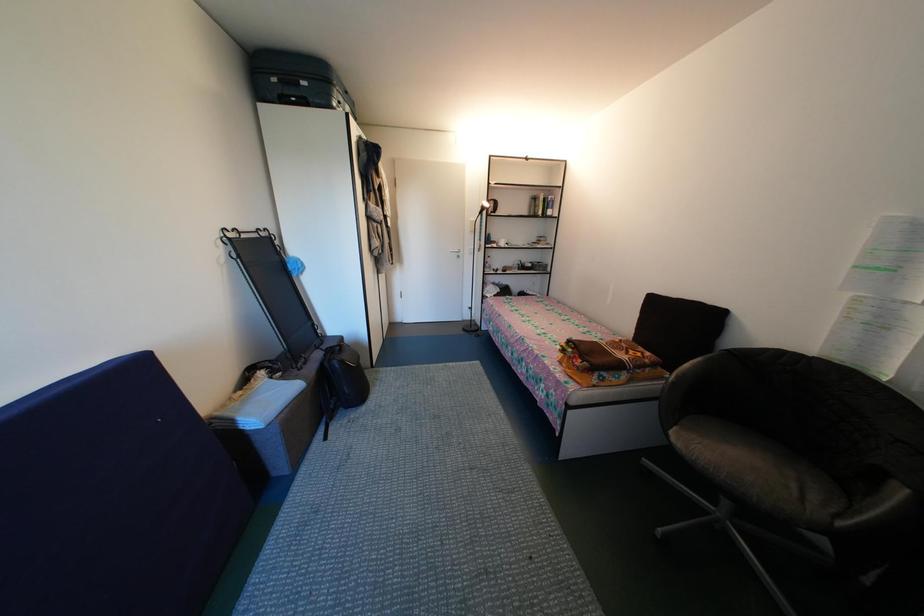
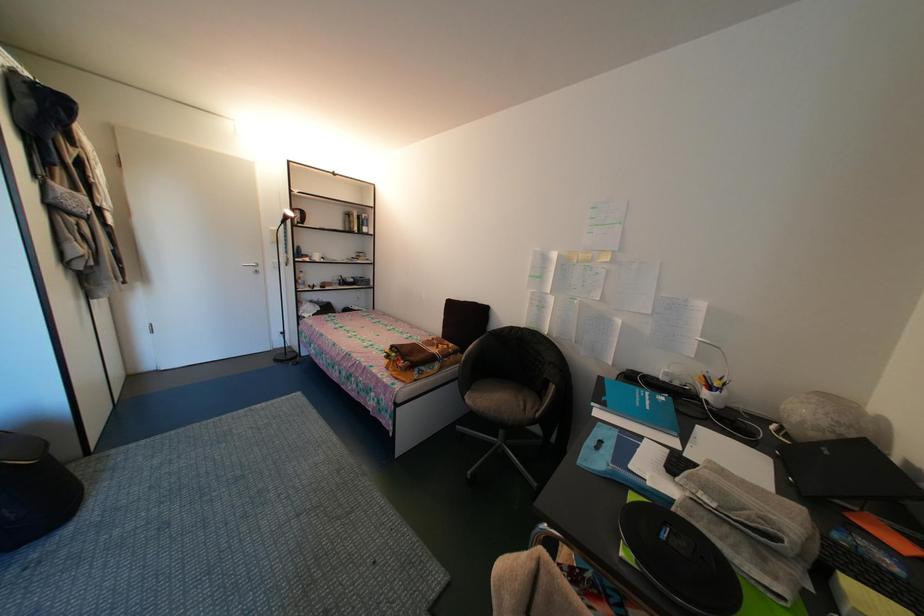
Question: The camera is either moving clockwise (left) or counter-clockwise (right) around the object. The first image is from the beginning of the video and the second image is from the end. Is the camera moving left or right when shooting the video?

Choices:
 (A) Left
 (B) Right

Answer: (A)